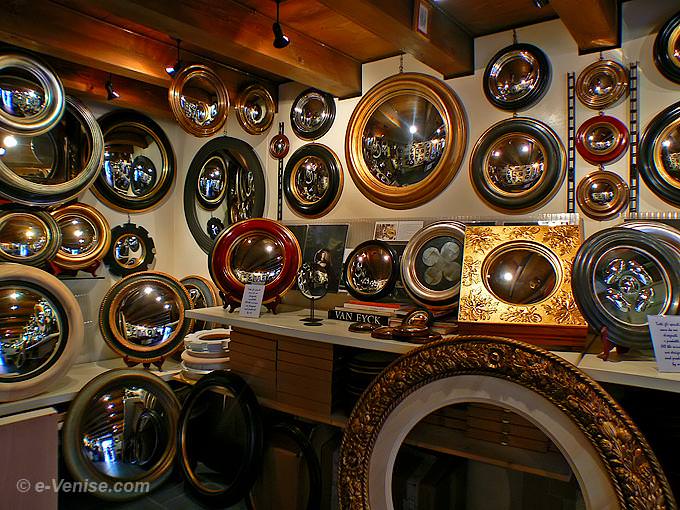
Where is `books`? The height and width of the screenshot is (510, 680). books is located at coordinates (343, 313), (351, 306), (362, 302).